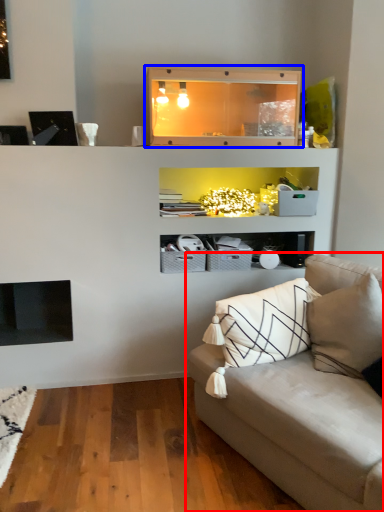
Question: Among these objects, which one is nearest to the camera, studio couch (highlighted by a red box) or shelf (highlighted by a blue box)?

Choices:
 (A) studio couch
 (B) shelf

Answer: (A)